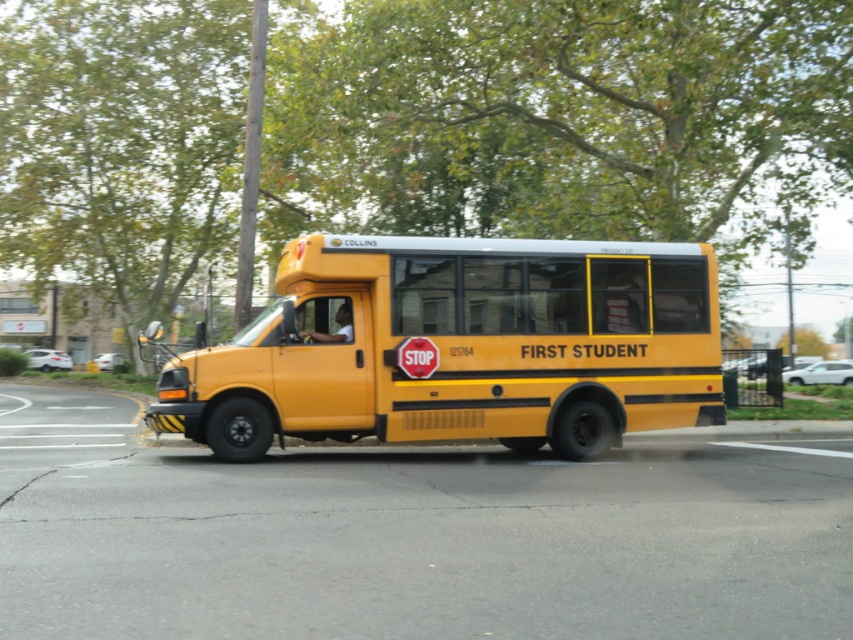
Is yellow matte bus at center thinner than red matte stop sign at center?

Indeed, yellow matte bus at center has a lesser width compared to red matte stop sign at center.

Which is behind, point (677, 406) or point (407, 353)?

Positioned behind is point (677, 406).

The width and height of the screenshot is (853, 640). What are the coordinates of `yellow matte bus at center` in the screenshot? It's located at (460, 346).